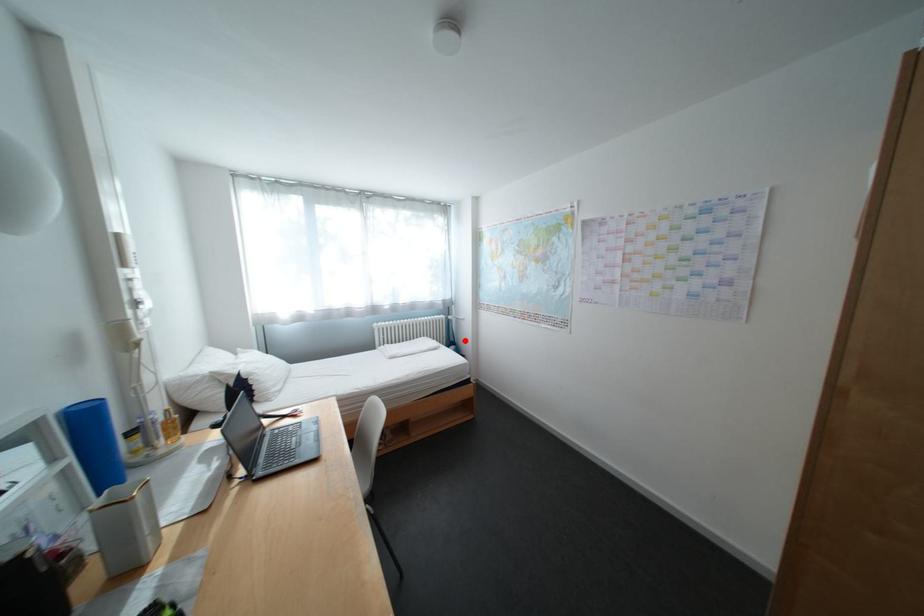
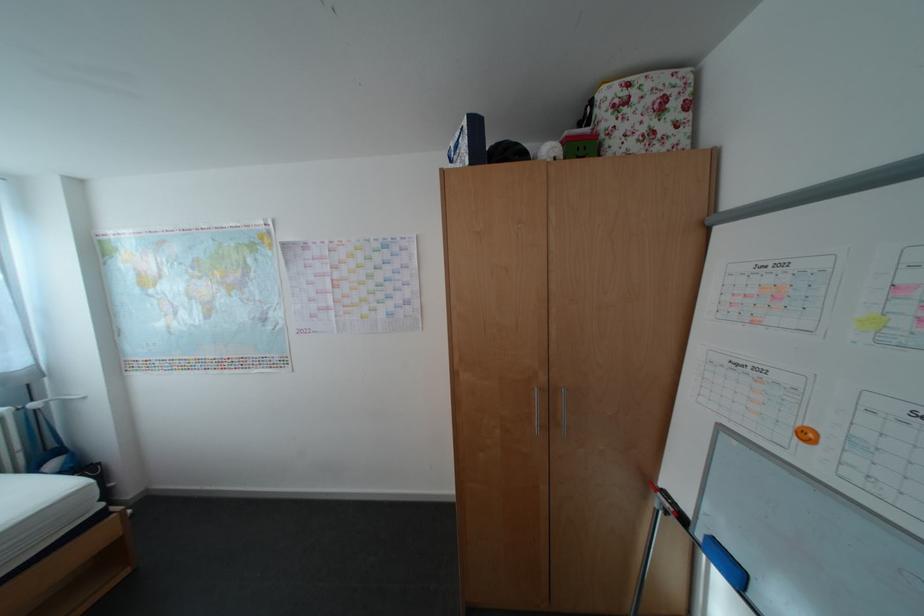
Locate, in the second image, the point that corresponds to the highlighted location in the first image.

(67, 447)